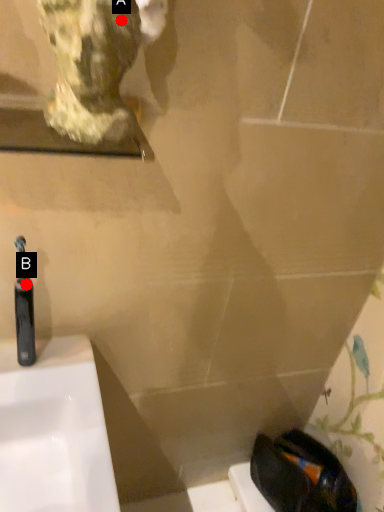
Question: Two points are circled on the image, labeled by A and B beside each circle. Which of the following is the farthest from the observer?

Choices:
 (A) A is further
 (B) B is further

Answer: (B)